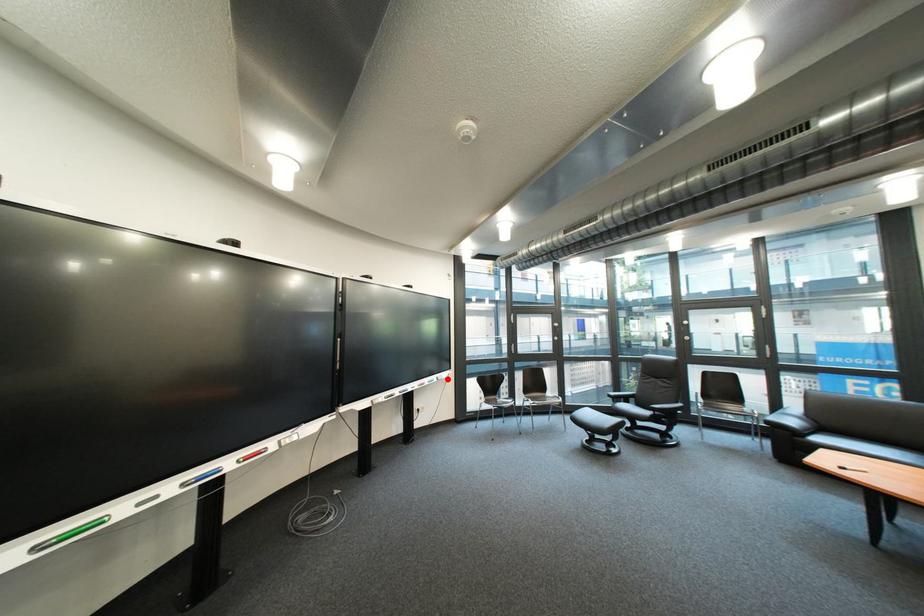
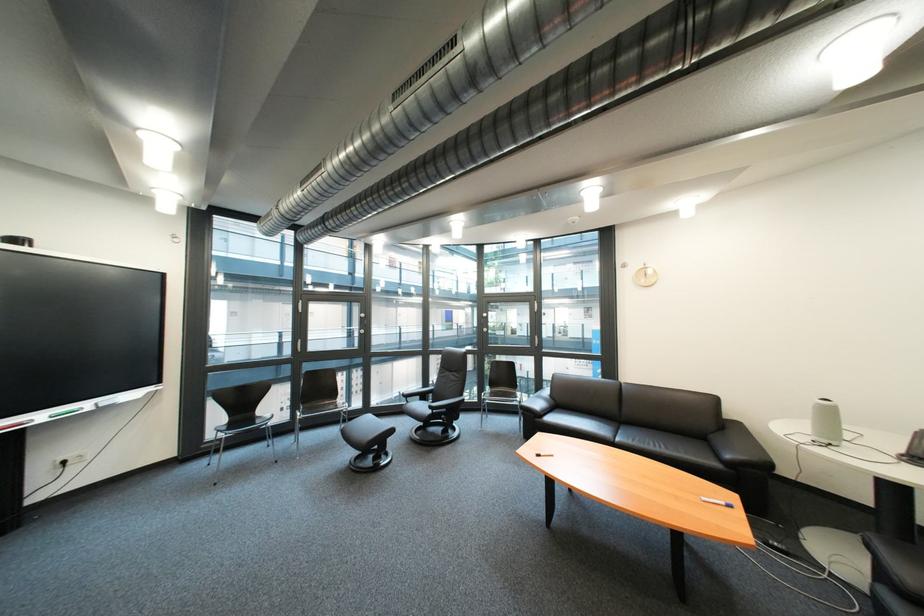
Question: I am providing you with two images of the same scene from different viewpoints. In image1, a red point is highlighted. Considering the same 3D point in image2, which of the following is correct?

Choices:
 (A) It is closer
 (B) It is farther

Answer: (A)